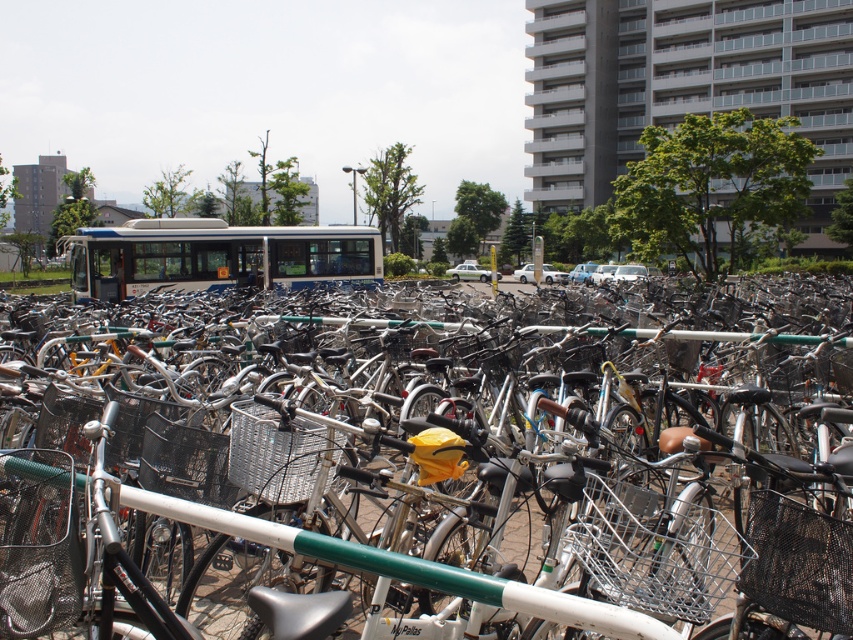
How far apart are silver metallic bicycle at center and white matte bus at center?

silver metallic bicycle at center and white matte bus at center are 21.76 meters apart.

Looking at this image, can you confirm if silver metallic bicycle at center is shorter than white matte bus at center?

Yes, silver metallic bicycle at center is shorter than white matte bus at center.

Between point (466, 476) and point (138, 256), which one is positioned behind?

The point (138, 256) is behind.

This screenshot has height=640, width=853. What are the coordinates of `silver metallic bicycle at center` in the screenshot? It's located at [x=207, y=576].